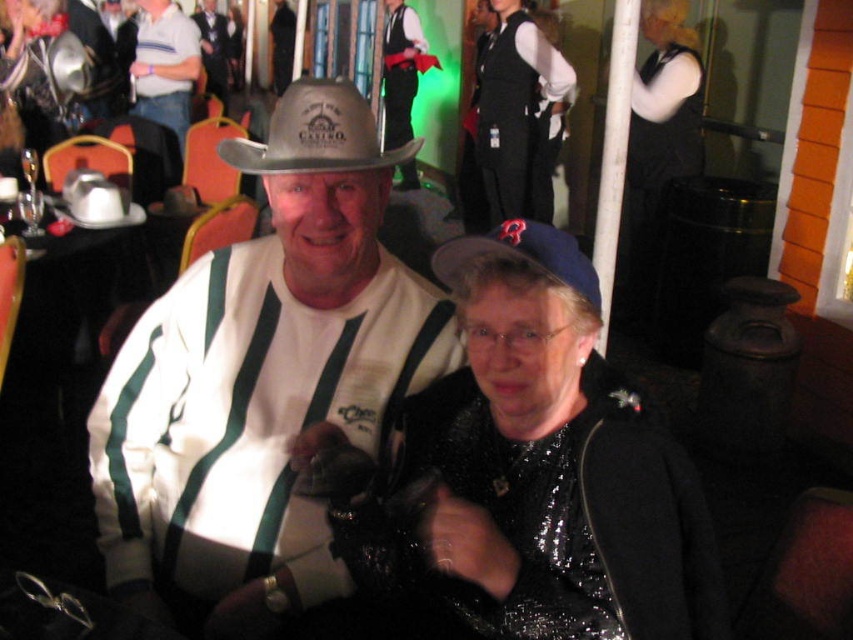
Between white matte cowboy hat at center and matte black cowboy hat at upper center, which one appears on the right side from the viewer's perspective?

Positioned to the right is white matte cowboy hat at center.

Can you confirm if white matte cowboy hat at center is smaller than matte black cowboy hat at upper center?

Yes, white matte cowboy hat at center is smaller than matte black cowboy hat at upper center.

You are a GUI agent. You are given a task and a screenshot of the screen. Output one action in this format:
    pyautogui.click(x=<x>, y=<y>)
    Task: Click on the white matte cowboy hat at center
    This screenshot has width=853, height=640.
    Given the screenshot: What is the action you would take?
    (262, 380)

Is point (596, 621) positioned behind point (175, 8)?

No.

What are the coordinates of `shiny black jacket at center` in the screenshot? It's located at (553, 461).

Locate an element on the screen. shiny black jacket at center is located at coordinates (553, 461).

Is gray felt cowboy hat at center to the right of white striped shirt at upper left from the viewer's perspective?

Yes, gray felt cowboy hat at center is to the right of white striped shirt at upper left.

Who is shorter, gray felt cowboy hat at center or white striped shirt at upper left?

With less height is gray felt cowboy hat at center.

Does point (288, 172) come behind point (136, 113)?

That is False.

The width and height of the screenshot is (853, 640). I want to click on gray felt cowboy hat at center, so click(317, 132).